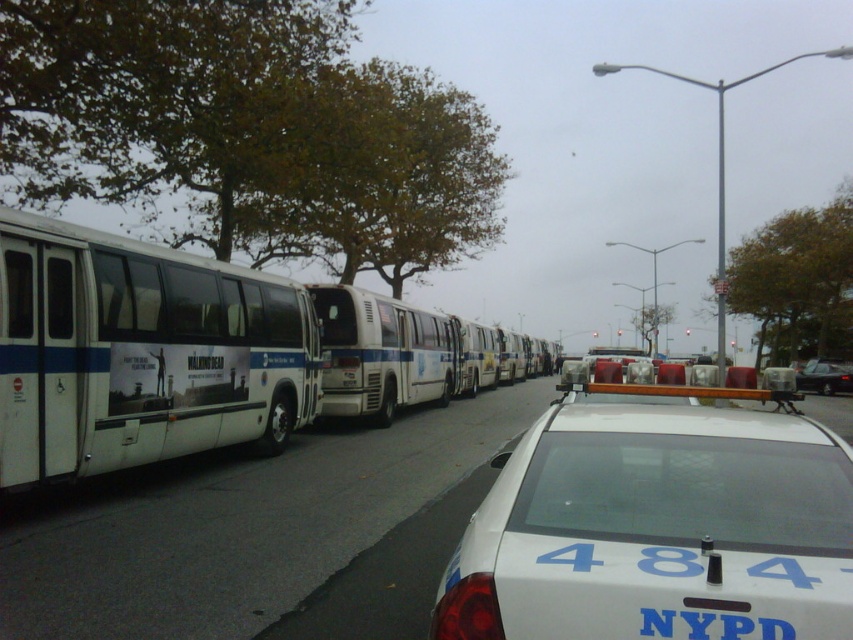
You are a pedestrian standing on the sidewalk looking at the row of buses. Which bus, the white matte bus at left or the white matte bus at center, is positioned higher relative to the other?

The white matte bus at left is positioned higher than the white matte bus at center.

You are standing at the center of the road and want to take a photo of the white matte bus at left. Which direction should you turn to face it?

You should turn to your left to face the white matte bus at left since it is located on the left side of the road.

You are a pedestrian standing at the point marked by the coordinate point at (x=140, y=353). Looking around, you see a white matte bus at left. Which direction should you walk to reach the white matte bus at left?

The point at (x=140, y=353) marks the white matte bus at left, so you are already at the white matte bus at left.